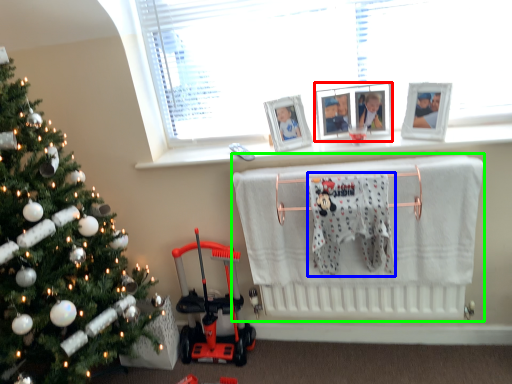
Question: Which is nearer to the picture frame (highlighted by a red box)? bath towel (highlighted by a blue box) or infant bed (highlighted by a green box).

Choices:
 (A) bath towel
 (B) infant bed

Answer: (A)